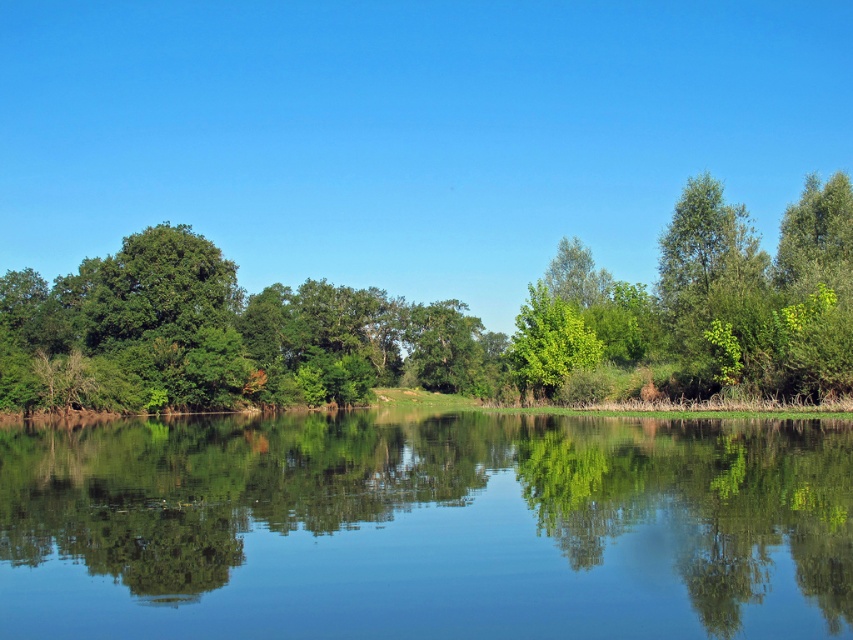
Question: Estimate the real-world distances between objects in this image. Which object is closer to the transparent water at center?

Choices:
 (A) green leafy tree at center
 (B) green leafy tree at left

Answer: (A)

Question: Can you confirm if transparent water at center is positioned below green leafy tree at left?

Choices:
 (A) yes
 (B) no

Answer: (A)

Question: Among these objects, which one is nearest to the camera?

Choices:
 (A) green leafy tree at left
 (B) green leafy tree at center

Answer: (A)

Question: Is green leafy tree at left smaller than green leafy tree at center?

Choices:
 (A) yes
 (B) no

Answer: (B)

Question: Is green leafy tree at left below green leafy tree at center?

Choices:
 (A) no
 (B) yes

Answer: (A)

Question: Which object is positioned farthest from the transparent water at center?

Choices:
 (A) green leafy tree at left
 (B) green leafy tree at center

Answer: (A)